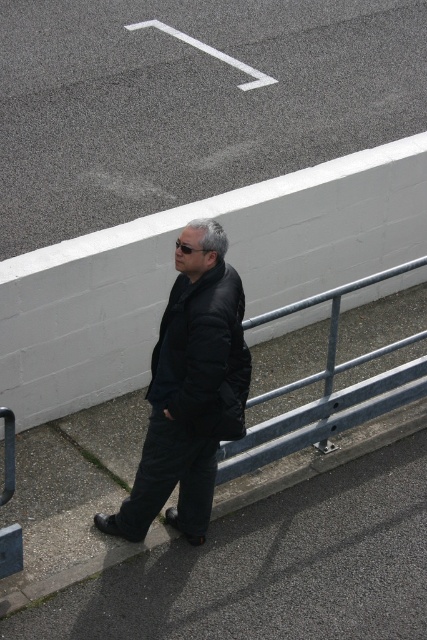
Question: Does gray asphalt at lower center come behind black matte jacket at center?

Choices:
 (A) yes
 (B) no

Answer: (A)

Question: Does gray asphalt at lower center have a larger size compared to black puffy jacket at center?

Choices:
 (A) yes
 (B) no

Answer: (A)

Question: Does black matte jacket at center have a smaller size compared to black puffy jacket at center?

Choices:
 (A) yes
 (B) no

Answer: (B)

Question: Estimate the real-world distances between objects in this image. Which object is farther from the gray asphalt at lower center?

Choices:
 (A) black puffy jacket at center
 (B) black matte jacket at center

Answer: (A)

Question: Which object appears closest to the camera in this image?

Choices:
 (A) black puffy jacket at center
 (B) black matte jacket at center

Answer: (A)

Question: Which point is farther to the camera?

Choices:
 (A) black matte jacket at center
 (B) black puffy jacket at center
 (C) gray asphalt at lower center

Answer: (C)